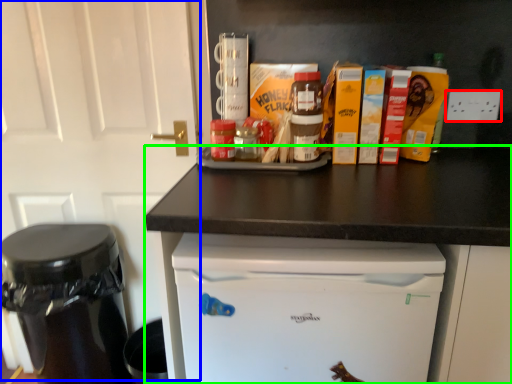
Question: Considering the real-world distances, which object is farthest from electric outlet (highlighted by a red box)? door (highlighted by a blue box) or counter (highlighted by a green box)?

Choices:
 (A) door
 (B) counter

Answer: (A)